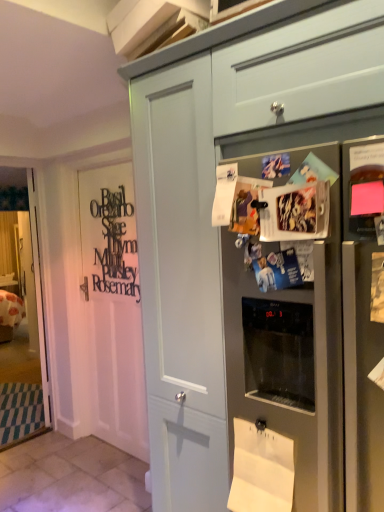
Question: Is clear glass door at left at the right side of satin silver refrigerator at upper right?

Choices:
 (A) yes
 (B) no

Answer: (B)

Question: Considering the relative sizes of clear glass door at left and satin silver refrigerator at upper right in the image provided, is clear glass door at left thinner than satin silver refrigerator at upper right?

Choices:
 (A) yes
 (B) no

Answer: (A)

Question: From the image's perspective, is clear glass door at left located above satin silver refrigerator at upper right?

Choices:
 (A) yes
 (B) no

Answer: (B)

Question: Could you tell me if clear glass door at left is facing satin silver refrigerator at upper right?

Choices:
 (A) yes
 (B) no

Answer: (A)

Question: Is clear glass door at left oriented away from satin silver refrigerator at upper right?

Choices:
 (A) yes
 (B) no

Answer: (B)

Question: From a real-world perspective, is matte gray drawer at upper center above or below white paper at lower center?

Choices:
 (A) below
 (B) above

Answer: (B)

Question: Is matte gray drawer at upper center wider or thinner than white paper at lower center?

Choices:
 (A) thin
 (B) wide

Answer: (B)

Question: From the image's perspective, relative to white paper at lower center, is matte gray drawer at upper center above or below?

Choices:
 (A) below
 (B) above

Answer: (B)

Question: Is point (256, 111) closer or farther from the camera than point (278, 454)?

Choices:
 (A) closer
 (B) farther

Answer: (B)

Question: Is matte gray drawer at upper center taller or shorter than satin silver refrigerator at upper right?

Choices:
 (A) tall
 (B) short

Answer: (B)

Question: Looking at the image, does matte gray drawer at upper center seem bigger or smaller compared to satin silver refrigerator at upper right?

Choices:
 (A) big
 (B) small

Answer: (A)

Question: Visually, is matte gray drawer at upper center positioned to the left or to the right of satin silver refrigerator at upper right?

Choices:
 (A) left
 (B) right

Answer: (B)

Question: From the image's perspective, is matte gray drawer at upper center located above or below satin silver refrigerator at upper right?

Choices:
 (A) above
 (B) below

Answer: (A)

Question: Considering the positions of white paper at lower center and clear glass door at left in the image, is white paper at lower center bigger or smaller than clear glass door at left?

Choices:
 (A) big
 (B) small

Answer: (B)

Question: Would you say white paper at lower center is to the left or to the right of clear glass door at left in the picture?

Choices:
 (A) right
 (B) left

Answer: (A)